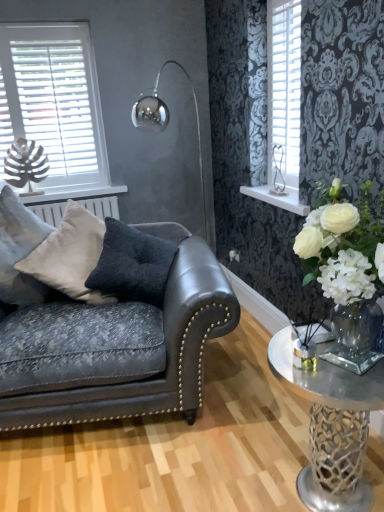
Question: Considering their positions, is leather couch at left located in front of or behind white plastic shutter at upper right?

Choices:
 (A) front
 (B) behind

Answer: (A)

Question: Is leather couch at left spatially inside white plastic shutter at upper right, or outside of it?

Choices:
 (A) outside
 (B) inside

Answer: (A)

Question: Based on their relative distances, which object is nearer to the soft white fabric pillow at upper left, which appears as the 1th pillow when viewed from the left?

Choices:
 (A) white plastic shutter at upper right
 (B) suede-like beige pillow at center, positioned as the second pillow in right-to-left order
 (C) white silk flower at center
 (D) clear glass vase at right
 (E) white wood shelf at upper right

Answer: (B)

Question: Considering the real-world distances, which object is farthest from the dark gray textured cushion at center, the first pillow from the right?

Choices:
 (A) suede-like beige pillow at center, the 2th pillow from the left
 (B) leather couch at left
 (C) clear glass vase at right
 (D) clear glass vase at lower right
 (E) white plastic shutter at upper right

Answer: (D)